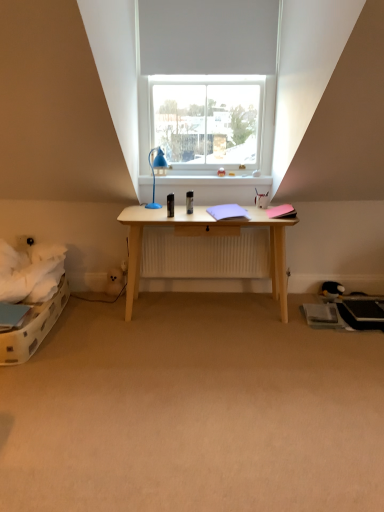
Question: From a real-world perspective, relative to white matte window at upper center, is white glossy window sill at upper center vertically above or below?

Choices:
 (A) below
 (B) above

Answer: (A)

Question: In terms of width, does white glossy window sill at upper center look wider or thinner when compared to white matte window at upper center?

Choices:
 (A) wide
 (B) thin

Answer: (A)

Question: Which object is the farthest from the white glossy window sill at upper center?

Choices:
 (A) blue plastic lamp at center
 (B) white matte window at upper center
 (C) beige carpet at center
 (D) black plush toy at lower right

Answer: (C)

Question: Estimate the real-world distances between objects in this image. Which object is closer to the beige carpet at center?

Choices:
 (A) black plush toy at lower right
 (B) blue plastic lamp at center
 (C) white glossy window sill at upper center
 (D) white matte window at upper center

Answer: (C)